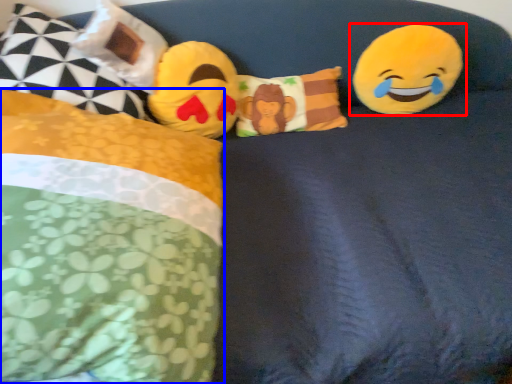
Question: Which object appears farthest to the camera in this image, toy (highlighted by a red box) or pillow (highlighted by a blue box)?

Choices:
 (A) toy
 (B) pillow

Answer: (A)